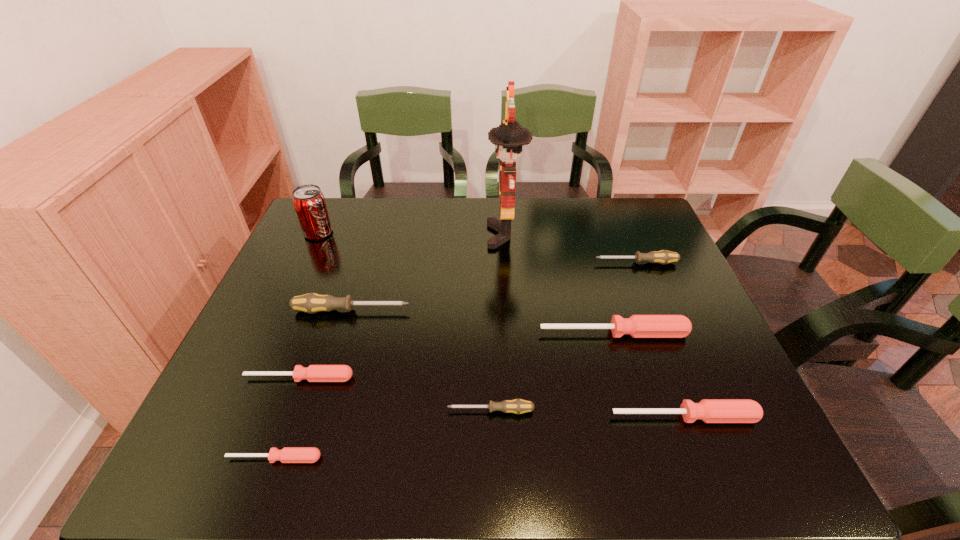
You are a GUI agent. You are given a task and a screenshot of the screen. Output one action in this format:
    pyautogui.click(x=<x>, y=<y>)
    Task: Click on the vacant space at the right edge of the desktop
    Image resolution: width=960 pixels, height=540 pixels.
    Given the screenshot: What is the action you would take?
    point(700,336)

You are a GUI agent. You are given a task and a screenshot of the screen. Output one action in this format:
    pyautogui.click(x=<x>, y=<y>)
    Task: Click on the vacant area at the far left corner of the desktop
    The height and width of the screenshot is (540, 960).
    Given the screenshot: What is the action you would take?
    pyautogui.click(x=345, y=211)

In the image, there is a desktop. In order to click on blank space at the far right corner in this screenshot , I will do `click(635, 239)`.

You are a GUI agent. You are given a task and a screenshot of the screen. Output one action in this format:
    pyautogui.click(x=<x>, y=<y>)
    Task: Click on the unoccupied area between the second gray screwdriver from right to left and the nearest red screwdriver
    The height and width of the screenshot is (540, 960).
    Given the screenshot: What is the action you would take?
    pyautogui.click(x=382, y=435)

Locate an element on the screen. This screenshot has height=540, width=960. unoccupied position between the nutcracker and the biggest red screwdriver is located at coordinates (560, 284).

Locate an element on the screen. The image size is (960, 540). vacant area between the farthest red screwdriver and the second nearest red screwdriver is located at coordinates (649, 375).

Where is `free spot between the farthest red screwdriver and the shortest object`? free spot between the farthest red screwdriver and the shortest object is located at coordinates (444, 396).

What are the coordinates of `vacant area that lies between the second tallest object and the farthest screwdriver` in the screenshot? It's located at (477, 248).

Identify the location of free area in between the nearest gray screwdriver and the nearest screwdriver. The width and height of the screenshot is (960, 540). (382, 435).

You are a GUI agent. You are given a task and a screenshot of the screen. Output one action in this format:
    pyautogui.click(x=<x>, y=<y>)
    Task: Click on the free space between the biggest red screwdriver and the third farthest red screwdriver
    The image size is (960, 540).
    Given the screenshot: What is the action you would take?
    pyautogui.click(x=649, y=375)